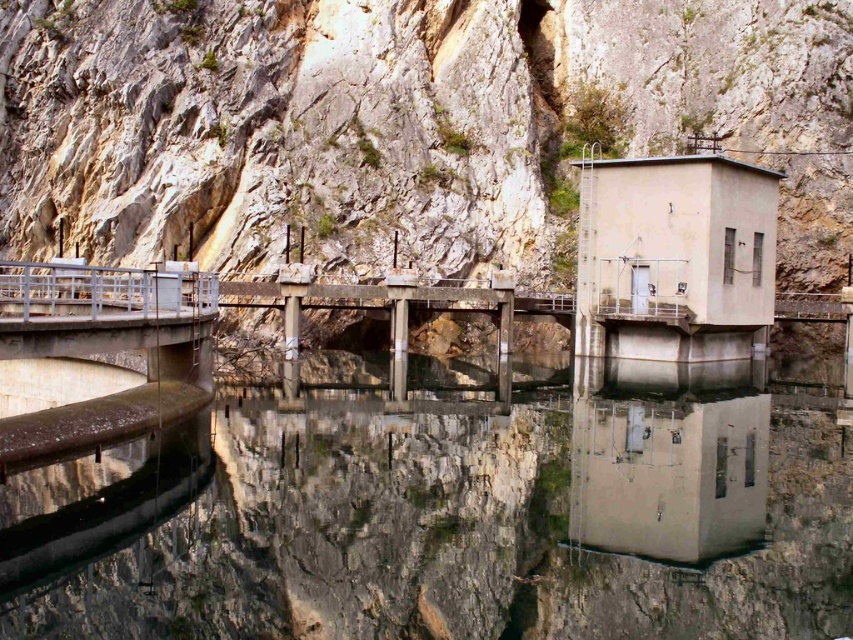
You are standing at the dam and want to cross to the other side. There is a transparent concrete river at center and a rough stone mountain at upper left. Which object is closer to you as you plan your path?

The transparent concrete river at center is closer to you than the rough stone mountain at upper left, so you should consider crossing over the transparent concrete river at center first.

You are a civil engineer inspecting the dam structure. You notice the transparent concrete river at center and the rough stone mountain at upper left. Which object is located to the right of the other?

The transparent concrete river at center is positioned on the right side of rough stone mountain at upper left.

You are a civil engineer inspecting the dam structure. You observe the transparent concrete river at center and the rough stone mountain at upper left. Which of these two features takes up more area in the image?

The rough stone mountain at upper left occupies more space than the transparent concrete river at center, so it takes up more area in the image.